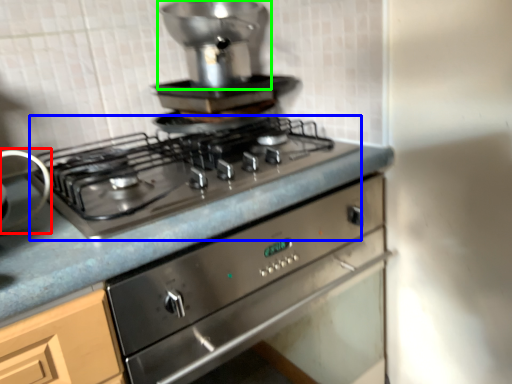
Question: Which object is the farthest from appliance (highlighted by a red box)? Choose among these: gas stove (highlighted by a blue box) or appliance (highlighted by a green box).

Choices:
 (A) gas stove
 (B) appliance

Answer: (B)